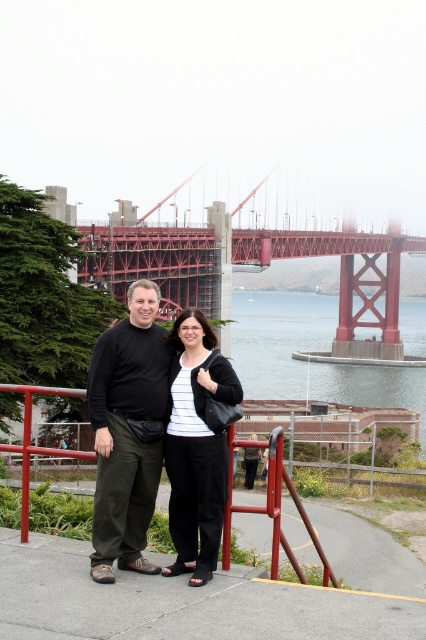
Who is more distant from viewer, (158,483) or (170,392)?

Positioned behind is point (170,392).

Locate an element on the screen. dark green pants at center is located at coordinates (127, 433).

This screenshot has width=426, height=640. I want to click on dark green pants at center, so click(127, 433).

The height and width of the screenshot is (640, 426). Identify the location of dark green pants at center. (127, 433).

Between dark green pants at center and clear water at center, which one appears on the right side from the viewer's perspective?

Positioned to the right is clear water at center.

Find the location of a particular element. dark green pants at center is located at coordinates click(x=127, y=433).

At what (x,y) coordinates should I click in order to perform the action: click on dark green pants at center. Please return your answer as a coordinate pair (x, y). Image resolution: width=426 pixels, height=640 pixels. Looking at the image, I should click on (127, 433).

Which of these two, clear water at center or black fabric jacket at center, stands taller?

With more height is clear water at center.

How distant is clear water at center from black fabric jacket at center?

clear water at center is 884.18 feet from black fabric jacket at center.

Which is in front, point (285, 332) or point (219, 451)?

Positioned in front is point (219, 451).

In order to click on clear water at center in this screenshot , I will do `click(310, 358)`.